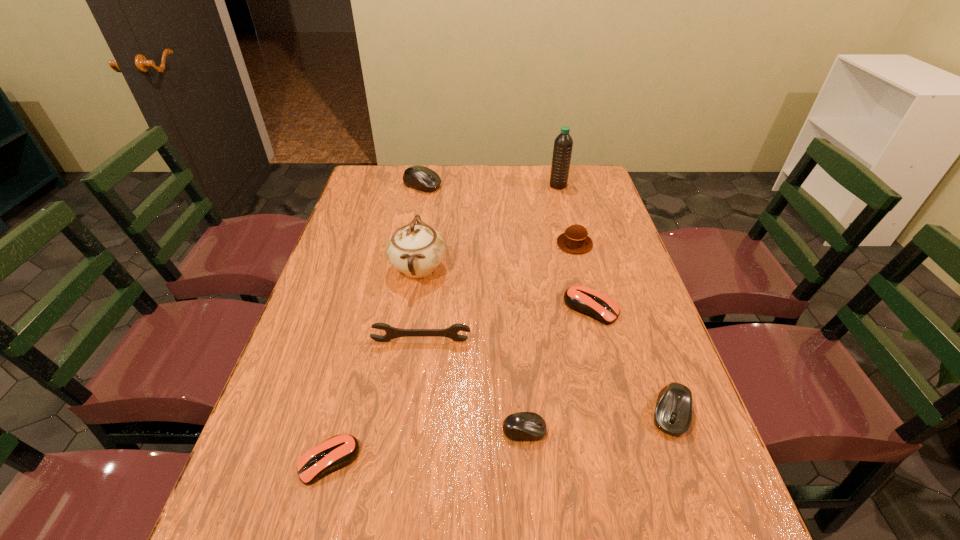
Where is `orange computer mouse that is the second closest to the farthest computer mouse`? This screenshot has height=540, width=960. orange computer mouse that is the second closest to the farthest computer mouse is located at coordinates (335, 453).

Identify which orange computer mouse is the second closest to the second farthest computer mouse. Please provide its 2D coordinates. Your answer should be formatted as a tuple, i.e. [(x, y)], where the tuple contains the x and y coordinates of a point satisfying the conditions above.

[(335, 453)]

You are a GUI agent. You are given a task and a screenshot of the screen. Output one action in this format:
    pyautogui.click(x=<x>, y=<y>)
    Task: Click on the vacant space that satisfies the following two spatial constraints: 1. on the back side of the ninth shortest object; 2. on the right side of the second shortest object
    The height and width of the screenshot is (540, 960).
    Given the screenshot: What is the action you would take?
    pyautogui.click(x=379, y=268)